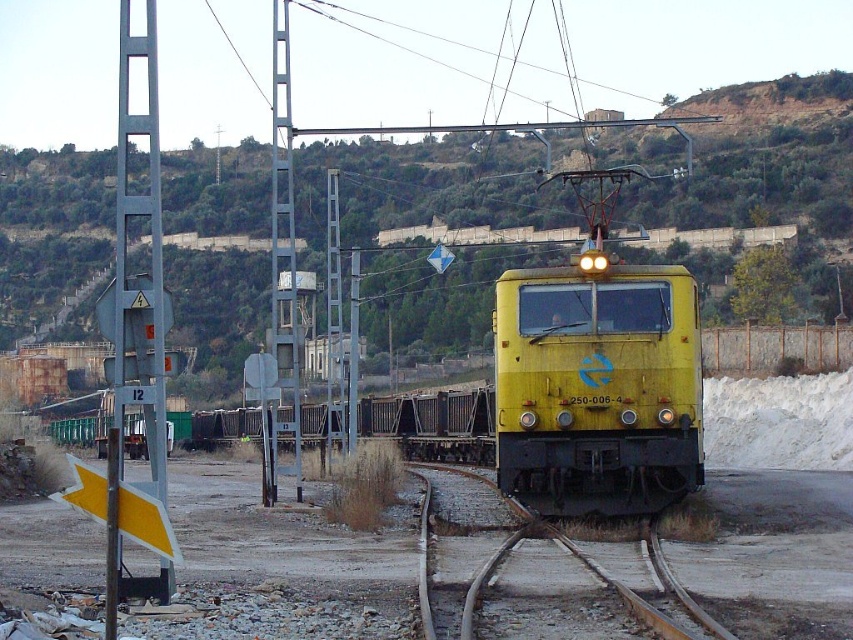
Question: Which object is closer to the camera taking this photo?

Choices:
 (A) yellow/yellowish metal train track at center
 (B) green grassy hillside at upper center
 (C) yellow matte train at center

Answer: (A)

Question: From the image, what is the correct spatial relationship of yellow matte train at center in relation to yellow/yellowish metal train track at center?

Choices:
 (A) right
 (B) left

Answer: (A)

Question: Which is farther from the green grassy hillside at upper center?

Choices:
 (A) yellow matte train at center
 (B) yellow/yellowish metal train track at center

Answer: (A)

Question: Is green grassy hillside at upper center wider than yellow matte train at center?

Choices:
 (A) yes
 (B) no

Answer: (A)

Question: Is green grassy hillside at upper center smaller than yellow/yellowish metal train track at center?

Choices:
 (A) yes
 (B) no

Answer: (B)

Question: Estimate the real-world distances between objects in this image. Which object is closer to the yellow matte train at center?

Choices:
 (A) green grassy hillside at upper center
 (B) yellow/yellowish metal train track at center

Answer: (B)